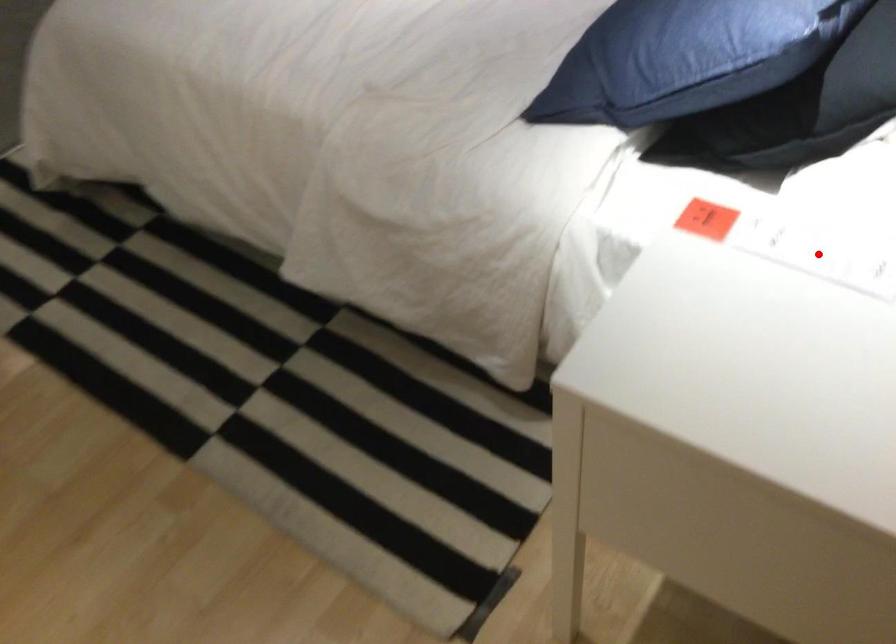
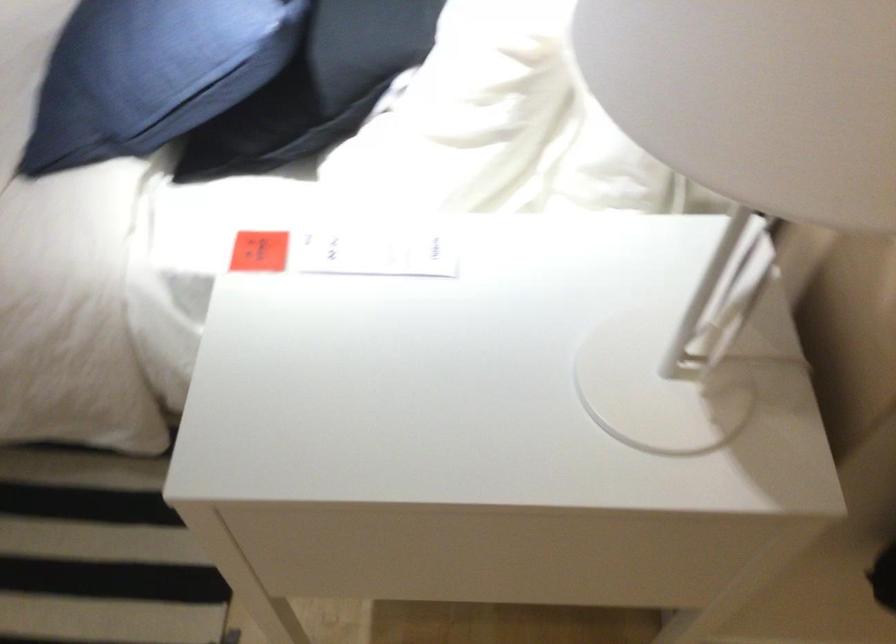
The point at the highlighted location is marked in the first image. Where is the corresponding point in the second image?

(375, 252)